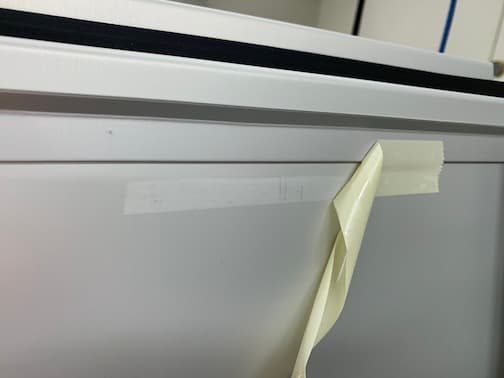
Locate an element on the screen. sticky side of tape is located at coordinates (313, 316), (359, 210).